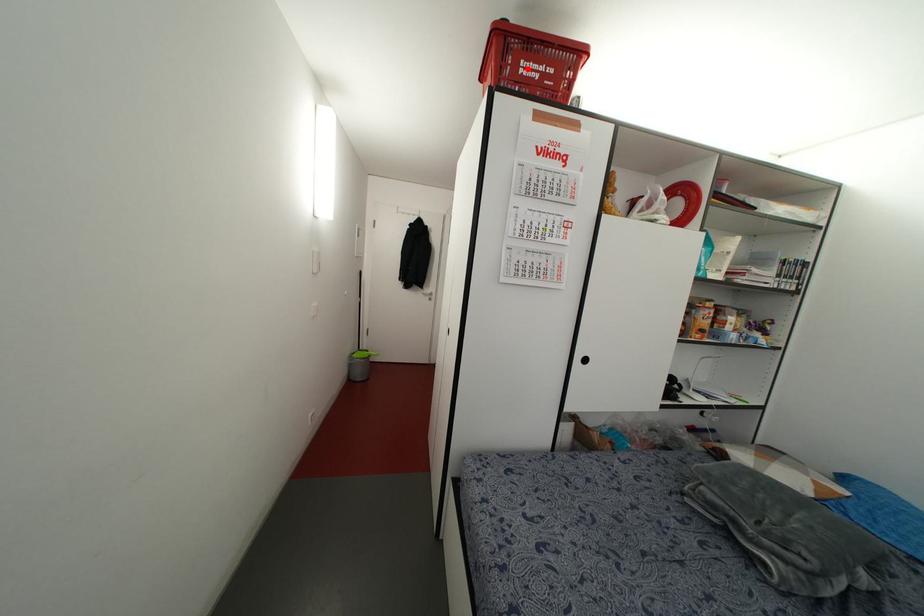
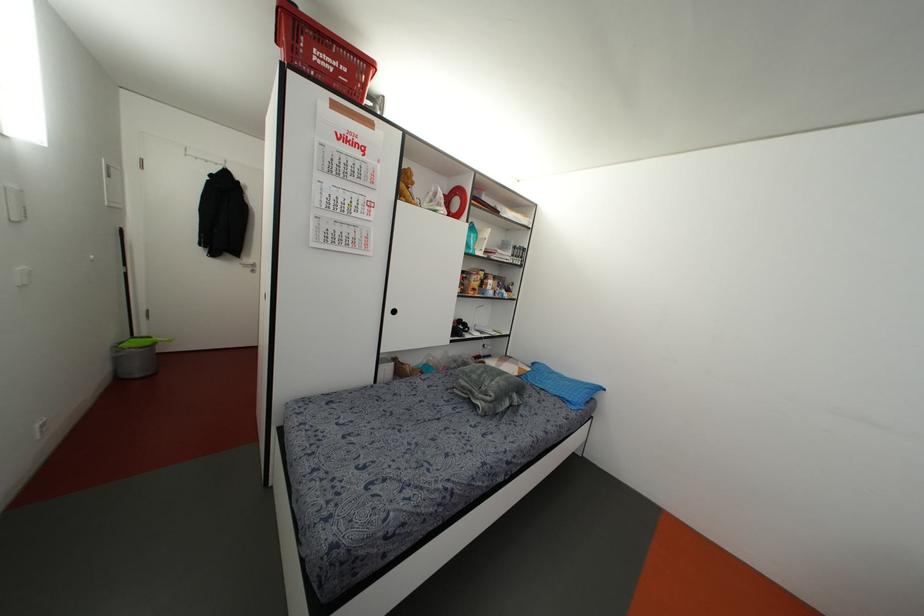
Find the pixel in the second image that matches the highlighted location in the first image.

(322, 59)